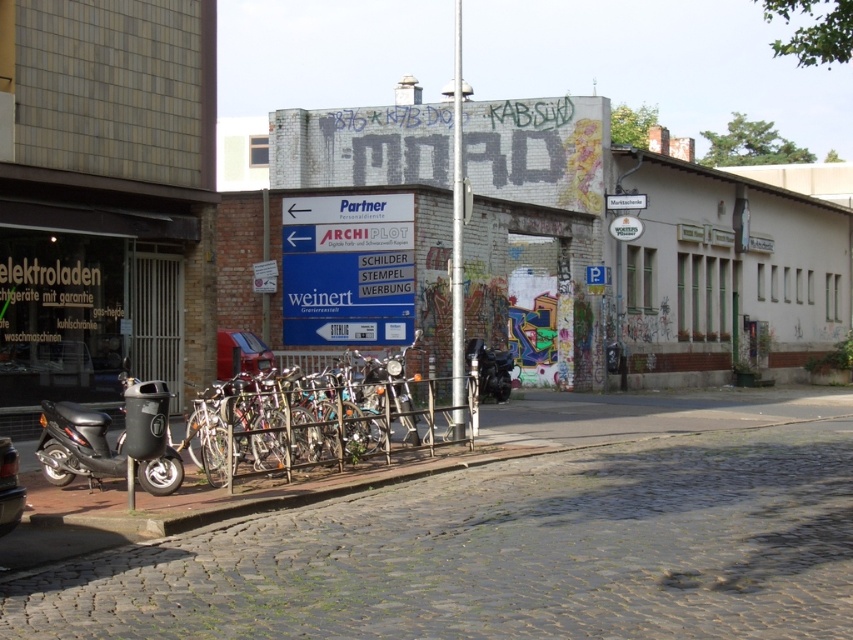
Is point (358, 355) behind point (171, 456)?

Yes, point (358, 355) is behind point (171, 456).

Is shiny metallic bicycles at center below matte black scooter at lower left?

Indeed, shiny metallic bicycles at center is positioned under matte black scooter at lower left.

Is point (265, 381) less distant than point (55, 412)?

That is False.

You are a GUI agent. You are given a task and a screenshot of the screen. Output one action in this format:
    pyautogui.click(x=<x>, y=<y>)
    Task: Click on the shiny metallic bicycles at center
    This screenshot has height=640, width=853.
    Given the screenshot: What is the action you would take?
    pyautogui.click(x=305, y=416)

Is the position of matte black scooter at lower left more distant than that of shiny chrome motorcycle at center?

No, it is in front of shiny chrome motorcycle at center.

Does matte black scooter at lower left have a greater height compared to shiny chrome motorcycle at center?

Indeed, matte black scooter at lower left has a greater height compared to shiny chrome motorcycle at center.

Between point (55, 445) and point (396, 355), which one is positioned behind?

Positioned behind is point (396, 355).

The width and height of the screenshot is (853, 640). What are the coordinates of `matte black scooter at lower left` in the screenshot? It's located at (107, 444).

Who is taller, shiny metallic bicycles at center or shiny black motorcycle at center?

Standing taller between the two is shiny black motorcycle at center.

In the scene shown: Can you confirm if shiny metallic bicycles at center is smaller than shiny black motorcycle at center?

Correct, shiny metallic bicycles at center occupies less space than shiny black motorcycle at center.

This screenshot has height=640, width=853. I want to click on shiny metallic bicycles at center, so click(x=305, y=416).